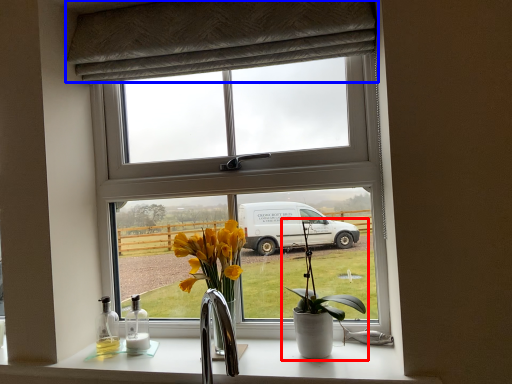
Question: Which object appears closest to the camera in this image, houseplant (highlighted by a red box) or curtain (highlighted by a blue box)?

Choices:
 (A) houseplant
 (B) curtain

Answer: (A)